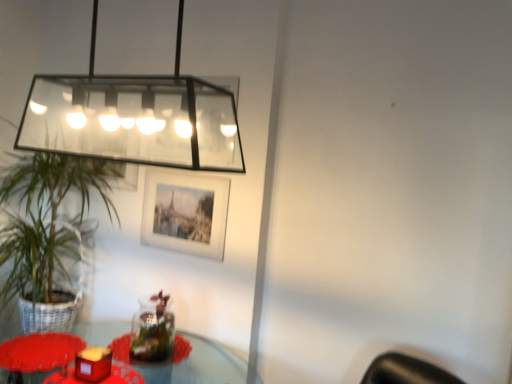
Question: From a real-world perspective, is green leafy plant at left below matte red candle at lower left?

Choices:
 (A) yes
 (B) no

Answer: (B)

Question: From the image's perspective, is green leafy plant at left below matte red candle at lower left?

Choices:
 (A) no
 (B) yes

Answer: (A)

Question: Is green leafy plant at left closer to the viewer compared to matte red candle at lower left?

Choices:
 (A) no
 (B) yes

Answer: (A)

Question: Can you confirm if green leafy plant at left is taller than matte red candle at lower left?

Choices:
 (A) no
 (B) yes

Answer: (B)

Question: Can you confirm if green leafy plant at left is wider than matte red candle at lower left?

Choices:
 (A) yes
 (B) no

Answer: (A)

Question: Visually, is matte red candle holder at lower left positioned to the left or to the right of matte white picture frame at center?

Choices:
 (A) left
 (B) right

Answer: (A)

Question: From the image's perspective, is matte red candle holder at lower left positioned above or below matte white picture frame at center?

Choices:
 (A) above
 (B) below

Answer: (B)

Question: From their relative heights in the image, would you say matte red candle holder at lower left is taller or shorter than matte white picture frame at center?

Choices:
 (A) short
 (B) tall

Answer: (A)

Question: From a real-world perspective, relative to matte white picture frame at center, is matte red candle holder at lower left vertically above or below?

Choices:
 (A) above
 (B) below

Answer: (B)

Question: In terms of size, does matte red candle holder at lower left appear bigger or smaller than translucent glass table at lower left?

Choices:
 (A) big
 (B) small

Answer: (B)

Question: Considering their positions, is matte red candle holder at lower left located in front of or behind translucent glass table at lower left?

Choices:
 (A) behind
 (B) front

Answer: (A)

Question: Is matte red candle holder at lower left taller or shorter than translucent glass table at lower left?

Choices:
 (A) short
 (B) tall

Answer: (A)

Question: Is point (81, 362) closer or farther from the camera than point (203, 347)?

Choices:
 (A) farther
 (B) closer

Answer: (B)

Question: Is clear glass rectangular light fixture at upper left situated inside translucent glass table at lower left or outside?

Choices:
 (A) outside
 (B) inside

Answer: (A)

Question: Considering the positions of clear glass rectangular light fixture at upper left and translucent glass table at lower left in the image, is clear glass rectangular light fixture at upper left taller or shorter than translucent glass table at lower left?

Choices:
 (A) short
 (B) tall

Answer: (B)